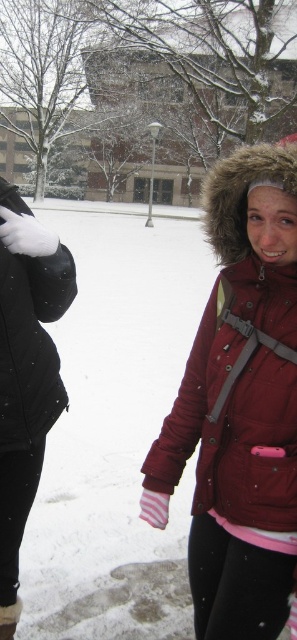
Question: Can you confirm if matte red jacket at right is thinner than black matte jacket at left?

Choices:
 (A) no
 (B) yes

Answer: (B)

Question: Is matte red jacket at right above black matte jacket at left?

Choices:
 (A) no
 (B) yes

Answer: (B)

Question: Which object is farther from the camera taking this photo?

Choices:
 (A) black matte jacket at left
 (B) matte red jacket at right

Answer: (A)

Question: Is matte red jacket at right behind black matte jacket at left?

Choices:
 (A) no
 (B) yes

Answer: (A)

Question: Among these points, which one is nearest to the camera?

Choices:
 (A) (149, 454)
 (B) (11, 294)

Answer: (B)